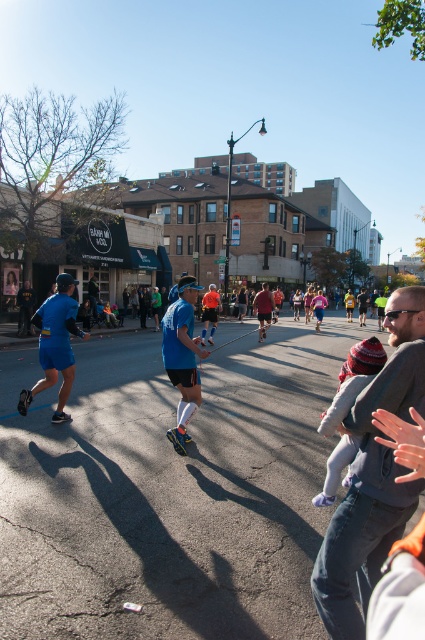
Between point (186, 285) and point (36, 388), which one is positioned in front?

Positioned in front is point (186, 285).

How distant is blue fabric running outfit at center from blue fabric shorts at left?

blue fabric running outfit at center is 2.16 meters away from blue fabric shorts at left.

Who is more forward, (190, 296) or (47, 339)?

Positioned in front is point (190, 296).

Identify the location of blue fabric running outfit at center. The height and width of the screenshot is (640, 425). (183, 356).

Between point (368, 456) and point (266, 282), which one is positioned in front?

Positioned in front is point (368, 456).

Which of these two, gray fleece jacket at center or matte brown shirt at center, stands taller?

Standing taller between the two is matte brown shirt at center.

Is point (422, 348) closer to camera compared to point (263, 328)?

Yes, point (422, 348) is closer to viewer.

This screenshot has height=640, width=425. Find the location of `gray fleece jacket at center`. gray fleece jacket at center is located at coordinates (373, 477).

Consider the image. Between gray fleece jacket at center and blue fabric running outfit at center, which one has more height?

blue fabric running outfit at center is taller.

Is point (351, 502) less distant than point (192, 353)?

Yes, point (351, 502) is closer to viewer.

Locate an element on the screen. The height and width of the screenshot is (640, 425). gray fleece jacket at center is located at coordinates (373, 477).